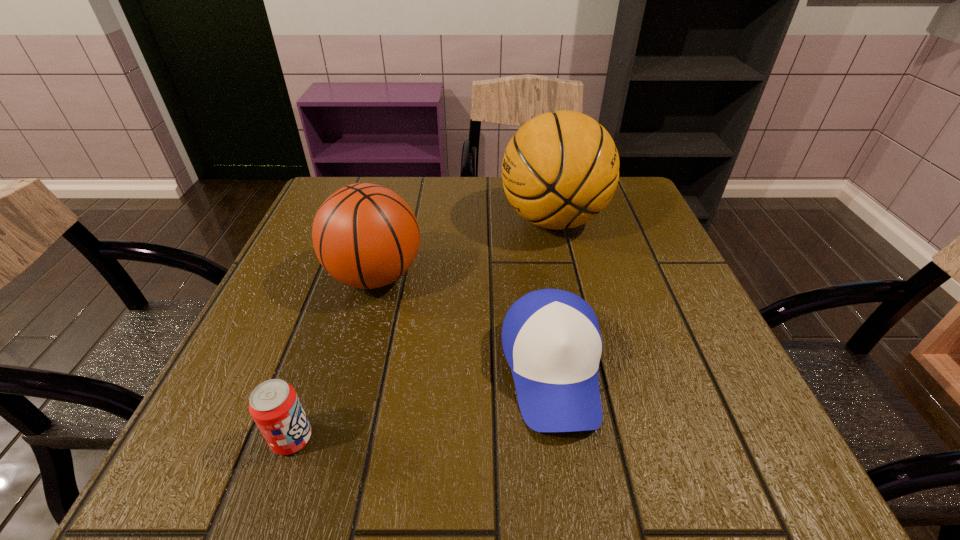
Where is `free location that satisfies the following two spatial constraints: 1. on the front-facing side of the baseball cap; 2. on the surface of the soda can`? The image size is (960, 540). free location that satisfies the following two spatial constraints: 1. on the front-facing side of the baseball cap; 2. on the surface of the soda can is located at coordinates (563, 438).

I want to click on vacant space that satisfies the following two spatial constraints: 1. on the front-facing side of the baseball cap; 2. on the surface of the soda can, so click(x=563, y=438).

The width and height of the screenshot is (960, 540). I want to click on vacant area in the image that satisfies the following two spatial constraints: 1. on the front-facing side of the baseball cap; 2. on the surface of the soda can, so click(x=563, y=438).

Where is `vacant space that satisfies the following two spatial constraints: 1. on the front-facing side of the baseball cap; 2. on the surface of the soda can`? This screenshot has width=960, height=540. vacant space that satisfies the following two spatial constraints: 1. on the front-facing side of the baseball cap; 2. on the surface of the soda can is located at coordinates 563,438.

This screenshot has width=960, height=540. Find the location of `free space that satisfies the following two spatial constraints: 1. on the surface of the right basketball near the brand logo; 2. on the front side of the third shortest object`. free space that satisfies the following two spatial constraints: 1. on the surface of the right basketball near the brand logo; 2. on the front side of the third shortest object is located at coordinates (565, 276).